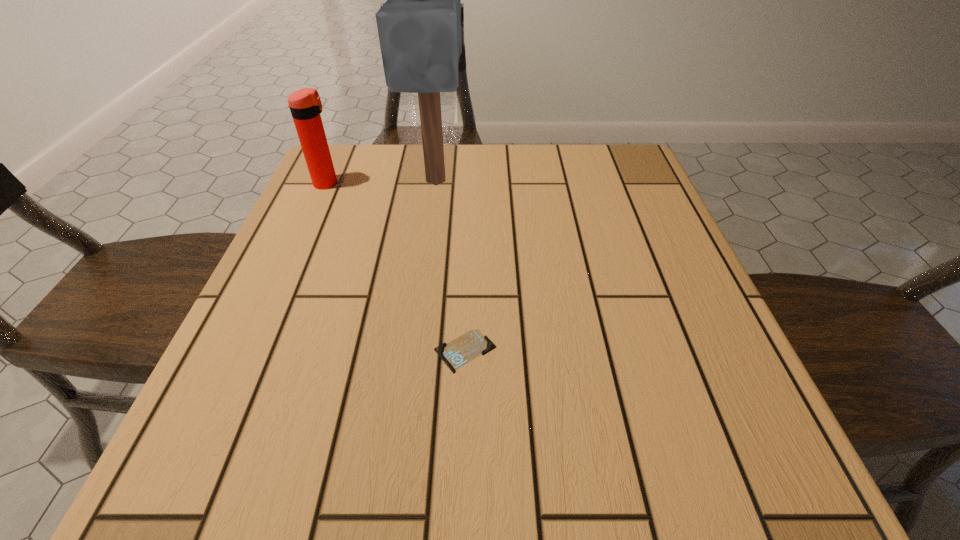
Image resolution: width=960 pixels, height=540 pixels. Find the location of `object at the left edge`. object at the left edge is located at coordinates [x=305, y=105].

This screenshot has height=540, width=960. Find the location of `object present at the far left corner`. object present at the far left corner is located at coordinates (305, 105).

The width and height of the screenshot is (960, 540). What are the coordinates of `vacant space at the far edge` in the screenshot? It's located at (422, 170).

At what (x,y) coordinates should I click in order to perform the action: click on free space at the left edge. Please return your answer as a coordinate pair (x, y). Looking at the image, I should click on (324, 288).

Find the location of a particular element. The width and height of the screenshot is (960, 540). free space at the right edge is located at coordinates (688, 295).

Identify the location of vacant area at the far left corner of the desktop. The image size is (960, 540). (372, 165).

This screenshot has height=540, width=960. I want to click on vacant space at the near left corner of the desktop, so click(x=287, y=475).

Image resolution: width=960 pixels, height=540 pixels. Identify the location of free space at the far right corner of the desktop. (591, 156).

Locate an element on the screen. empty space between the mallet and the leftmost object is located at coordinates (382, 182).

Find the location of a particular element. unoccupied area between the identity card and the tallest object is located at coordinates coord(450,266).